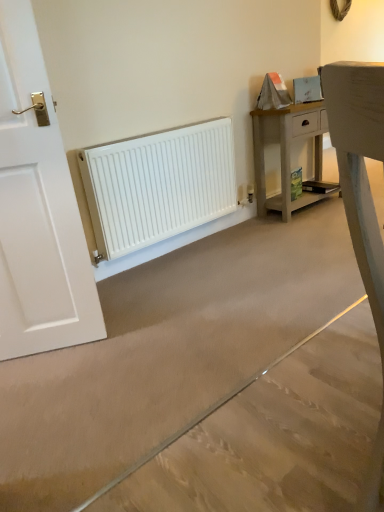
Question: Based on their positions, is white matte radiator at center located to the left or right of white matte radiator at lower left?

Choices:
 (A) left
 (B) right

Answer: (B)

Question: From their relative heights in the image, would you say white matte radiator at center is taller or shorter than white matte radiator at lower left?

Choices:
 (A) short
 (B) tall

Answer: (A)

Question: Considering the real-world distances, which object is closest to the light wood nightstand at upper right?

Choices:
 (A) white matte radiator at center
 (B) white matte radiator at lower left

Answer: (B)

Question: Which object is positioned farthest from the light wood nightstand at upper right?

Choices:
 (A) white matte radiator at lower left
 (B) white matte radiator at center

Answer: (B)